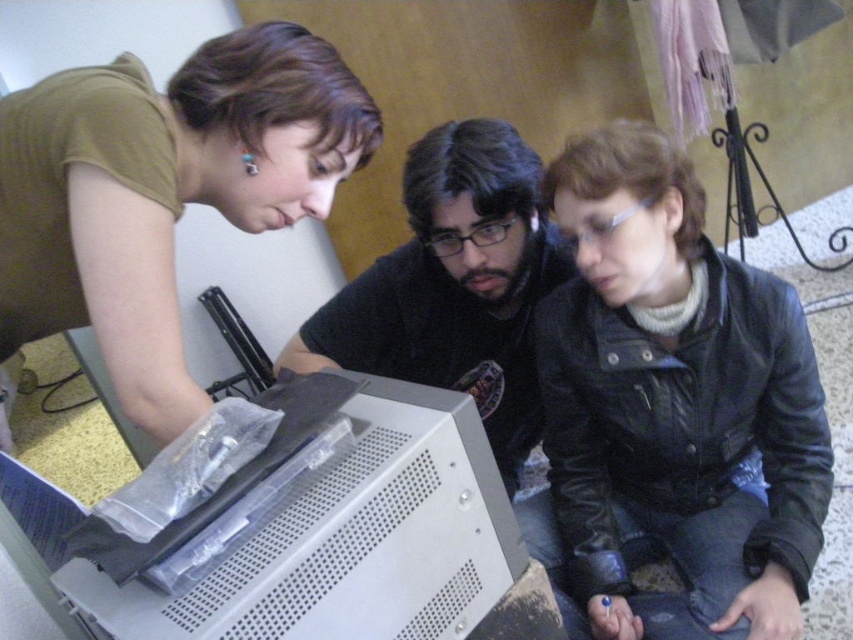
Question: Is black leather jacket at lower right further to camera compared to matte black shirt at center?

Choices:
 (A) no
 (B) yes

Answer: (A)

Question: Can you confirm if black leather jacket at lower right is wider than matte green shirt at upper left?

Choices:
 (A) no
 (B) yes

Answer: (A)

Question: Which of the following is the farthest from the observer?

Choices:
 (A) (556, 310)
 (B) (415, 161)

Answer: (A)

Question: Which of these objects is positioned closest to the matte black shirt at center?

Choices:
 (A) white plastic computer case at lower center
 (B) matte green shirt at upper left
 (C) black leather jacket at lower right

Answer: (C)

Question: Observing the image, what is the correct spatial positioning of white plastic computer case at lower center in reference to matte black shirt at center?

Choices:
 (A) below
 (B) above

Answer: (A)

Question: Estimate the real-world distances between objects in this image. Which object is farther from the matte green shirt at upper left?

Choices:
 (A) matte black shirt at center
 (B) black leather jacket at lower right

Answer: (B)